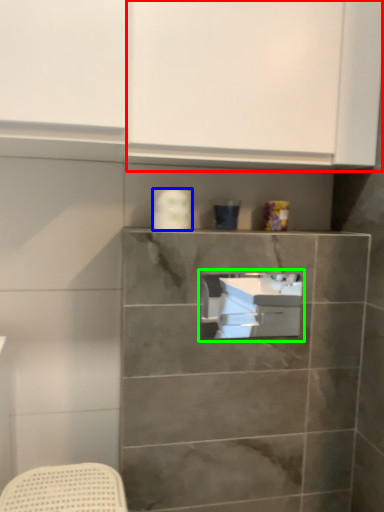
Question: Considering the real-world distances, which object is farthest from cabinetry (highlighted by a red box)? toilet paper (highlighted by a blue box) or sink (highlighted by a green box)?

Choices:
 (A) toilet paper
 (B) sink

Answer: (B)